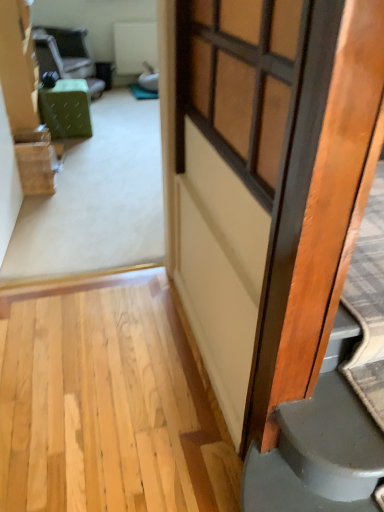
Question: Is matte wooden window at center located outside wooden door at right?

Choices:
 (A) no
 (B) yes

Answer: (B)

Question: Is matte wooden window at center in front of wooden door at right?

Choices:
 (A) no
 (B) yes

Answer: (A)

Question: From the image's perspective, does matte wooden window at center appear lower than wooden door at right?

Choices:
 (A) no
 (B) yes

Answer: (A)

Question: Is matte wooden window at center beside wooden door at right?

Choices:
 (A) yes
 (B) no

Answer: (B)

Question: From a real-world perspective, is matte wooden window at center positioned under wooden door at right based on gravity?

Choices:
 (A) yes
 (B) no

Answer: (B)

Question: From the image's perspective, relative to wooden door at right, is green fabric ottoman at center above or below?

Choices:
 (A) below
 (B) above

Answer: (B)

Question: From a real-world perspective, is green fabric ottoman at center above or below wooden door at right?

Choices:
 (A) below
 (B) above

Answer: (A)

Question: Looking at the image, does green fabric ottoman at center seem bigger or smaller compared to wooden door at right?

Choices:
 (A) small
 (B) big

Answer: (B)

Question: Is green fabric ottoman at center to the left or to the right of wooden door at right in the image?

Choices:
 (A) right
 (B) left

Answer: (B)

Question: Is point (263, 114) closer or farther from the camera than point (226, 130)?

Choices:
 (A) closer
 (B) farther

Answer: (A)

Question: From a real-world perspective, relative to wooden door at right, is matte wooden window at center vertically above or below?

Choices:
 (A) below
 (B) above

Answer: (B)

Question: From the image's perspective, relative to wooden door at right, is matte wooden window at center above or below?

Choices:
 (A) below
 (B) above

Answer: (B)

Question: Looking at the image, does matte wooden window at center seem bigger or smaller compared to wooden door at right?

Choices:
 (A) big
 (B) small

Answer: (B)

Question: In terms of width, does wooden door at right look wider or thinner when compared to green fabric chair at upper left?

Choices:
 (A) wide
 (B) thin

Answer: (B)

Question: Relative to green fabric chair at upper left, is wooden door at right in front or behind?

Choices:
 (A) behind
 (B) front

Answer: (B)